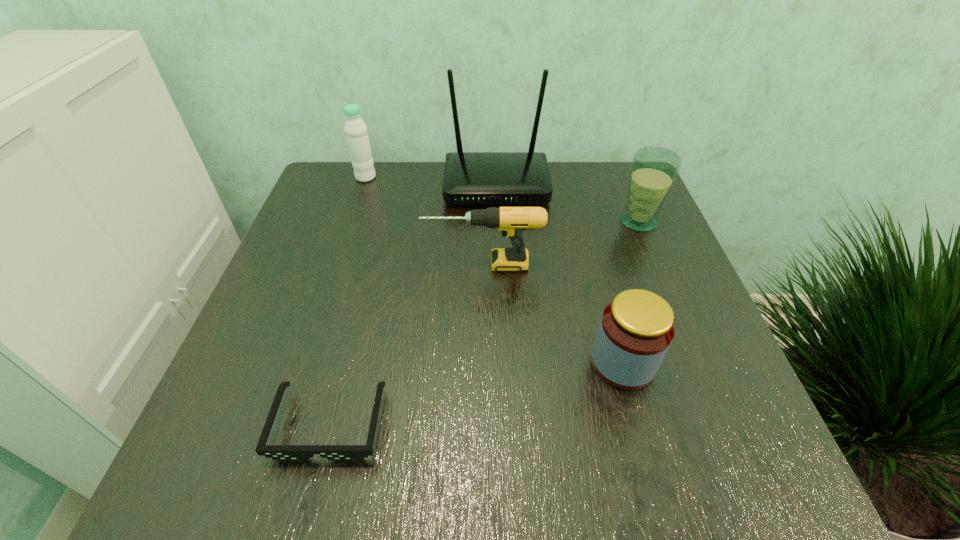
Identify the location of jar that is at the right edge. (636, 329).

At what (x,y) coordinates should I click in order to perform the action: click on object that is at the far left corner. Please return your answer as a coordinate pair (x, y). Looking at the image, I should click on (355, 129).

I want to click on object that is at the near left corner, so [x=284, y=453].

Locate an element on the screen. The image size is (960, 540). object situated at the far right corner is located at coordinates (654, 170).

In the image, there is a desktop. Identify the location of vacant space at the far edge. (420, 162).

At what (x,y) coordinates should I click in order to perform the action: click on blank area at the near edge. Please return your answer as a coordinate pair (x, y). The height and width of the screenshot is (540, 960). Looking at the image, I should click on (568, 467).

Image resolution: width=960 pixels, height=540 pixels. Find the location of `free region at the left edge`. free region at the left edge is located at coordinates (303, 360).

This screenshot has width=960, height=540. What are the coordinates of `vacant area at the right edge` in the screenshot? It's located at pos(677,359).

You are a GUI agent. You are given a task and a screenshot of the screen. Output one action in this format:
    pyautogui.click(x=<x>, y=<y>)
    Task: Click on the vacant space at the far right corner
    The image size is (960, 540).
    Given the screenshot: What is the action you would take?
    pyautogui.click(x=622, y=181)

At what (x,y) coordinates should I click in order to perform the action: click on vacant space at the near right corner of the desktop. Please return your answer as a coordinate pair (x, y). Image resolution: width=960 pixels, height=540 pixels. Looking at the image, I should click on [x=689, y=467].